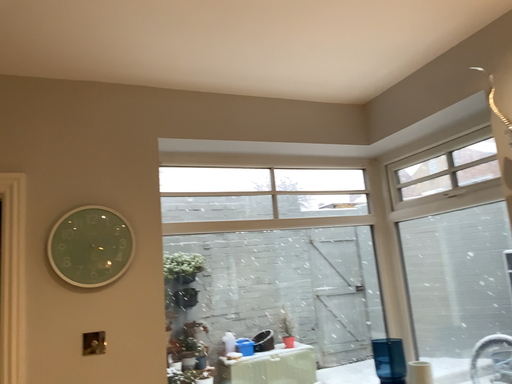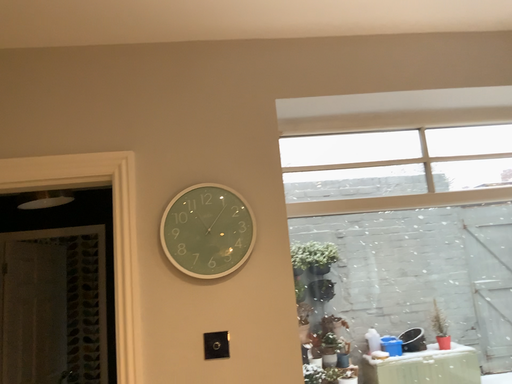
Question: Which way did the camera rotate in the video?

Choices:
 (A) rotated left
 (B) rotated right

Answer: (A)